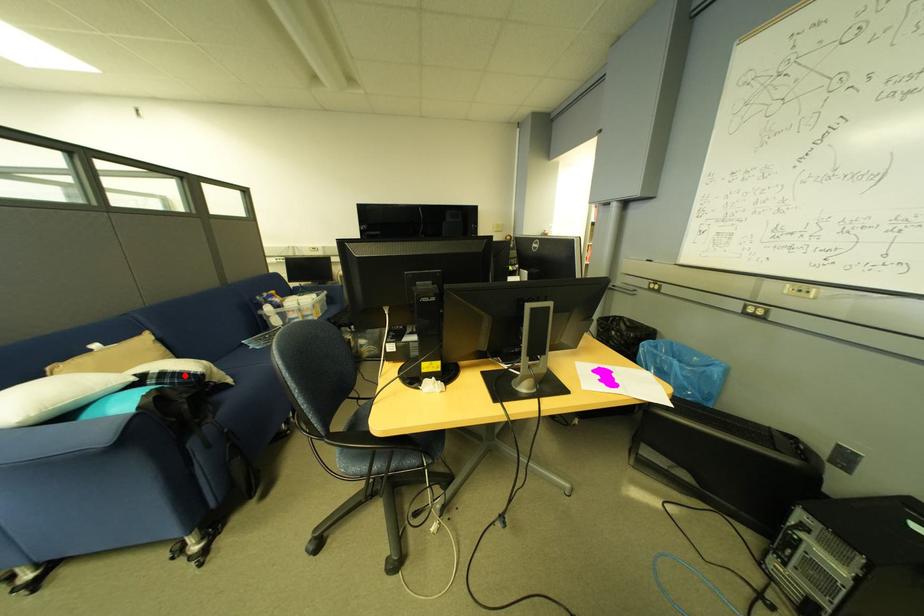
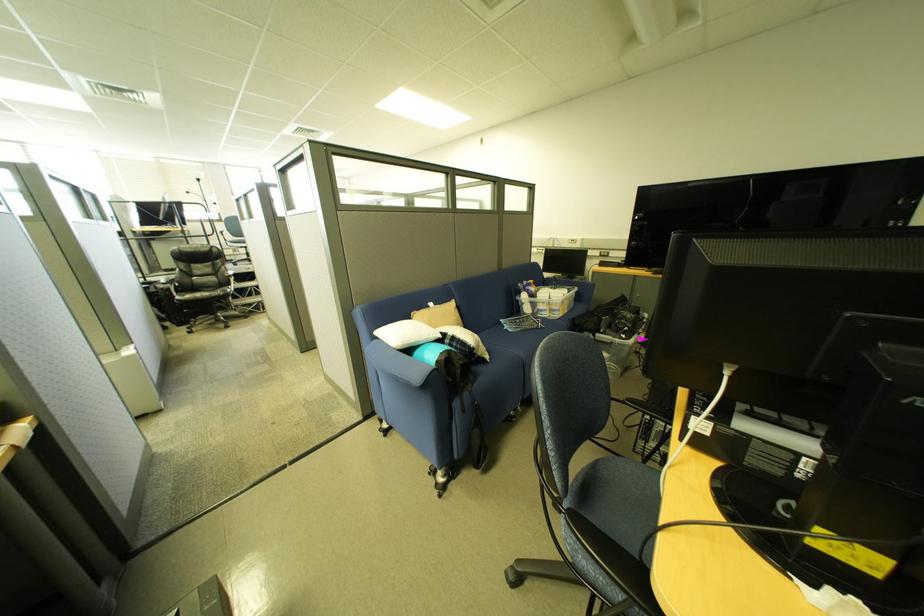
Find the pixel in the second image that matches the highlighted location in the first image.

(469, 342)